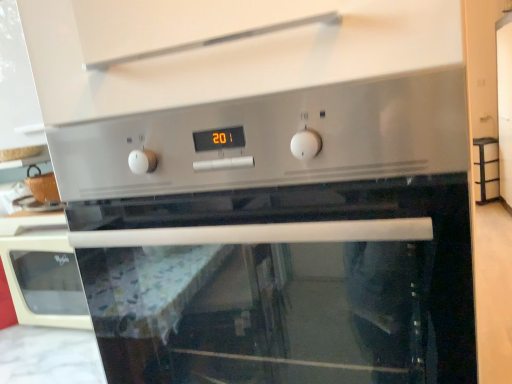
The image size is (512, 384). I want to click on satin silver oven at center, so click(280, 235).

This screenshot has width=512, height=384. What do you see at coordinates (280, 235) in the screenshot? I see `satin silver oven at center` at bounding box center [280, 235].

The height and width of the screenshot is (384, 512). Find the location of `satin silver oven at center`. satin silver oven at center is located at coordinates (280, 235).